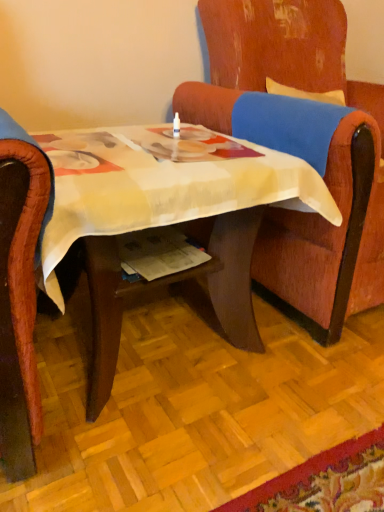
Question: Can wooden chair at center be found inside wooden desk at center?

Choices:
 (A) yes
 (B) no

Answer: (B)

Question: Is wooden desk at center looking in the opposite direction of wooden chair at center?

Choices:
 (A) yes
 (B) no

Answer: (B)

Question: Is wooden desk at center smaller than wooden chair at center?

Choices:
 (A) no
 (B) yes

Answer: (B)

Question: From a real-world perspective, is wooden desk at center located beneath wooden chair at center?

Choices:
 (A) yes
 (B) no

Answer: (A)

Question: Is wooden desk at center at the right side of wooden chair at center?

Choices:
 (A) yes
 (B) no

Answer: (B)

Question: Is wooden desk at center not inside wooden chair at center?

Choices:
 (A) yes
 (B) no

Answer: (A)

Question: From the image's perspective, is wooden chair at center beneath wooden desk at center?

Choices:
 (A) no
 (B) yes

Answer: (A)

Question: Is wooden chair at center further to camera compared to wooden desk at center?

Choices:
 (A) no
 (B) yes

Answer: (B)

Question: Is wooden chair at center positioned beyond the bounds of wooden desk at center?

Choices:
 (A) no
 (B) yes

Answer: (B)

Question: Considering the relative positions of wooden chair at center and wooden desk at center in the image provided, is wooden chair at center to the right of wooden desk at center from the viewer's perspective?

Choices:
 (A) yes
 (B) no

Answer: (A)

Question: Is wooden chair at center wider than wooden desk at center?

Choices:
 (A) yes
 (B) no

Answer: (A)

Question: Is wooden chair at center thinner than wooden desk at center?

Choices:
 (A) yes
 (B) no

Answer: (B)

Question: Looking at their shapes, would you say wooden chair at center is wider or thinner than wooden desk at center?

Choices:
 (A) thin
 (B) wide

Answer: (B)